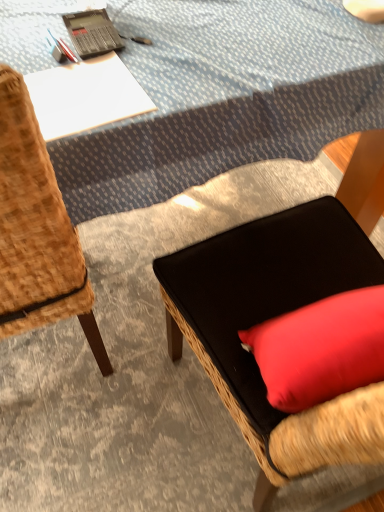
Find the location of a particular element. The image size is (384, 512). black plastic calculator at upper left is located at coordinates (92, 33).

This screenshot has width=384, height=512. I want to click on white paper at upper left, so click(85, 96).

The image size is (384, 512). Describe the element at coordinates (224, 96) in the screenshot. I see `blue textured tablecloth at upper center` at that location.

You are a GUI agent. You are given a task and a screenshot of the screen. Output one action in this format:
    pyautogui.click(x=<x>, y=<y>)
    Task: Click on the woven wood chair at left, which appears as the 1th chair when viewed from the left
    This screenshot has height=512, width=384.
    Given the screenshot: What is the action you would take?
    pyautogui.click(x=37, y=230)

Identify the location of black plastic calculator at upper left. (92, 33).

From the picture: Looking at the image, does white paper at upper left seem bigger or smaller compared to woven wood chair at left, which appears as the 1th chair when viewed from the left?

Clearly, white paper at upper left is smaller in size than woven wood chair at left, which appears as the 1th chair when viewed from the left.

From a real-world perspective, does white paper at upper left stand above woven wood chair at left, which is counted as the second chair, starting from the right?

Correct, in the physical world, white paper at upper left is higher than woven wood chair at left, which is counted as the second chair, starting from the right.

Identify the location of desk that is above the woven wood chair at left, which appears as the 1th chair when viewed from the left (from the image's perspective). (85, 96).

Choose the correct answer: Is white paper at upper left inside woven wood chair at left, which appears as the 1th chair when viewed from the left, or outside it?

white paper at upper left is located inside woven wood chair at left, which appears as the 1th chair when viewed from the left.

Consider the image. Measure the distance between black fabric cushion at center, which is the second chair in left-to-right order, and white paper at upper left.

black fabric cushion at center, which is the second chair in left-to-right order, and white paper at upper left are 16.40 inches apart.

Is black fabric cushion at center, the 1th chair from the right, oriented towards white paper at upper left?

No, black fabric cushion at center, the 1th chair from the right, is not oriented towards white paper at upper left.

Relative to white paper at upper left, is black fabric cushion at center, the 1th chair from the right, in front or behind?

Clearly, black fabric cushion at center, the 1th chair from the right, is in front of white paper at upper left.

Which is more to the left, black fabric cushion at center, which is the second chair in left-to-right order, or white paper at upper left?

From the viewer's perspective, white paper at upper left appears more on the left side.

Which of these two, blue textured tablecloth at upper center or woven wood chair at left, which appears as the 1th chair when viewed from the left, stands taller?

With more height is woven wood chair at left, which appears as the 1th chair when viewed from the left.

In the image, is blue textured tablecloth at upper center positioned in front of or behind woven wood chair at left, which appears as the 1th chair when viewed from the left?

In the image, blue textured tablecloth at upper center appears behind woven wood chair at left, which appears as the 1th chair when viewed from the left.

From a real-world perspective, relative to woven wood chair at left, which appears as the 1th chair when viewed from the left, is blue textured tablecloth at upper center vertically above or below?

blue textured tablecloth at upper center is situated lower than woven wood chair at left, which appears as the 1th chair when viewed from the left, in the real world.

Looking at this image, is blue textured tablecloth at upper center spatially inside woven wood chair at left, which appears as the 1th chair when viewed from the left, or outside of it?

blue textured tablecloth at upper center is spatially situated outside woven wood chair at left, which appears as the 1th chair when viewed from the left.

Does point (30, 73) come in front of point (341, 430)?

No.

From a real-world perspective, is white paper at upper left positioned above or below black fabric cushion at center, which is the second chair in left-to-right order?

Clearly, from a real-world perspective, white paper at upper left is above black fabric cushion at center, which is the second chair in left-to-right order.

Does white paper at upper left contain black fabric cushion at center, the 1th chair from the right?

No, black fabric cushion at center, the 1th chair from the right, is not inside white paper at upper left.

In terms of height, does white paper at upper left look taller or shorter compared to black fabric cushion at center, which is the second chair in left-to-right order?

white paper at upper left is shorter than black fabric cushion at center, which is the second chair in left-to-right order.

Can you confirm if woven wood chair at left, which is counted as the second chair, starting from the right, is thinner than white paper at upper left?

Incorrect, the width of woven wood chair at left, which is counted as the second chair, starting from the right, is not less than that of white paper at upper left.

Choose the correct answer: Is woven wood chair at left, which appears as the 1th chair when viewed from the left, inside white paper at upper left or outside it?

woven wood chair at left, which appears as the 1th chair when viewed from the left, is located beyond the bounds of white paper at upper left.

Based on the photo, are woven wood chair at left, which appears as the 1th chair when viewed from the left, and white paper at upper left beside each other?

No, woven wood chair at left, which appears as the 1th chair when viewed from the left, is not touching white paper at upper left.

Relative to white paper at upper left, is black plastic calculator at upper left in front or behind?

Visually, black plastic calculator at upper left is located behind white paper at upper left.

From the image's perspective, between black plastic calculator at upper left and white paper at upper left, which one is located above?

black plastic calculator at upper left, from the image's perspective.

How far apart are black plastic calculator at upper left and white paper at upper left?

4.80 inches.

Would you say black plastic calculator at upper left is a long distance from white paper at upper left?

No, black plastic calculator at upper left is not far away from white paper at upper left.

Which object is positioned more to the left, woven wood chair at left, which is counted as the second chair, starting from the right, or blue textured tablecloth at upper center?

From the viewer's perspective, woven wood chair at left, which is counted as the second chair, starting from the right, appears more on the left side.

Is the depth of woven wood chair at left, which is counted as the second chair, starting from the right, greater than that of blue textured tablecloth at upper center?

No, it is in front of blue textured tablecloth at upper center.

Is woven wood chair at left, which appears as the 1th chair when viewed from the left, bigger than blue textured tablecloth at upper center?

No.

The image size is (384, 512). Find the location of `desk located behind the woven wood chair at left, which appears as the 1th chair when viewed from the left`. desk located behind the woven wood chair at left, which appears as the 1th chair when viewed from the left is located at coordinates pos(85,96).

Locate an element on the screen. The height and width of the screenshot is (512, 384). chair on the right of white paper at upper left is located at coordinates (286, 419).

Looking at the image, which one is located closer to woven wood chair at left, which appears as the 1th chair when viewed from the left, blue textured tablecloth at upper center or black plastic calculator at upper left?

Among the two, blue textured tablecloth at upper center is located nearer to woven wood chair at left, which appears as the 1th chair when viewed from the left.

Considering their positions, is white paper at upper left positioned further to woven wood chair at left, which appears as the 1th chair when viewed from the left, than blue textured tablecloth at upper center?

blue textured tablecloth at upper center is further to woven wood chair at left, which appears as the 1th chair when viewed from the left.

Estimate the real-world distances between objects in this image. Which object is further from blue textured tablecloth at upper center, woven wood chair at left, which appears as the 1th chair when viewed from the left, or black fabric cushion at center, which is the second chair in left-to-right order?

woven wood chair at left, which appears as the 1th chair when viewed from the left, is positioned further to the anchor blue textured tablecloth at upper center.

Looking at the image, which one is located closer to black plastic calculator at upper left, woven wood chair at left, which appears as the 1th chair when viewed from the left, or blue textured tablecloth at upper center?

Among the two, blue textured tablecloth at upper center is located nearer to black plastic calculator at upper left.

When comparing their distances from blue textured tablecloth at upper center, does white paper at upper left or woven wood chair at left, which appears as the 1th chair when viewed from the left, seem further?

Among the two, woven wood chair at left, which appears as the 1th chair when viewed from the left, is located further to blue textured tablecloth at upper center.

Which object lies nearer to the anchor point black plastic calculator at upper left, white paper at upper left or blue textured tablecloth at upper center?

Among the two, white paper at upper left is located nearer to black plastic calculator at upper left.

Based on their spatial positions, is white paper at upper left or black fabric cushion at center, the 1th chair from the right, further from black plastic calculator at upper left?

Based on the image, black fabric cushion at center, the 1th chair from the right, appears to be further to black plastic calculator at upper left.

Based on their spatial positions, is black plastic calculator at upper left or woven wood chair at left, which appears as the 1th chair when viewed from the left, closer to black fabric cushion at center, which is the second chair in left-to-right order?

woven wood chair at left, which appears as the 1th chair when viewed from the left.

This screenshot has height=512, width=384. Find the location of `tablecloth between woven wood chair at left, which is counted as the second chair, starting from the right, and black plastic calculator at upper left in the front-back direction`. tablecloth between woven wood chair at left, which is counted as the second chair, starting from the right, and black plastic calculator at upper left in the front-back direction is located at coordinates (224, 96).

Image resolution: width=384 pixels, height=512 pixels. In order to click on desk positioned between black fabric cushion at center, which is the second chair in left-to-right order, and black plastic calculator at upper left from near to far in this screenshot , I will do click(85, 96).

This screenshot has width=384, height=512. I want to click on desk that lies between blue textured tablecloth at upper center and black fabric cushion at center, the 1th chair from the right, from top to bottom, so click(x=85, y=96).

You are a GUI agent. You are given a task and a screenshot of the screen. Output one action in this format:
    pyautogui.click(x=<x>, y=<y>)
    Task: Click on the laptop situated between white paper at upper left and blue textured tablecloth at upper center from left to right
    The width and height of the screenshot is (384, 512).
    Given the screenshot: What is the action you would take?
    pyautogui.click(x=92, y=33)